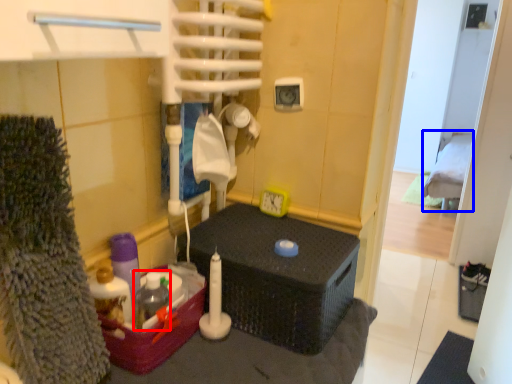
Question: Among these objects, which one is farthest to the camera, bottle (highlighted by a red box) or bed (highlighted by a blue box)?

Choices:
 (A) bottle
 (B) bed

Answer: (B)